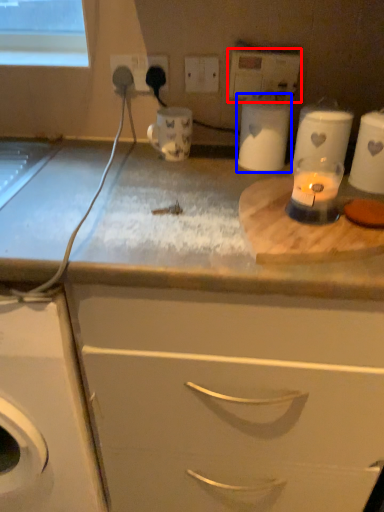
Question: Which object appears farthest to the camera in this image, electric outlet (highlighted by a red box) or appliance (highlighted by a blue box)?

Choices:
 (A) electric outlet
 (B) appliance

Answer: (A)